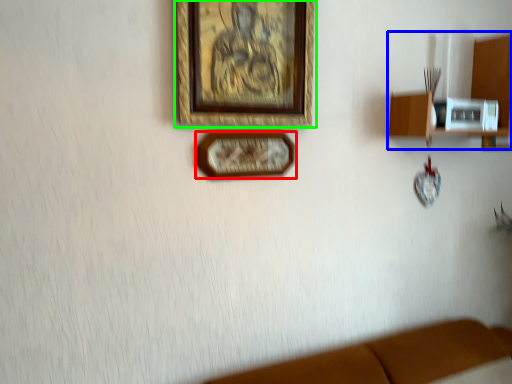
Question: Based on their relative distances, which object is farther from picture frame (highlighted by a red box)? Choose from shelf (highlighted by a blue box) and picture frame (highlighted by a green box).

Choices:
 (A) shelf
 (B) picture frame

Answer: (A)